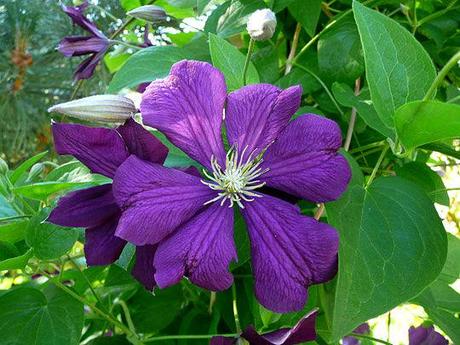
Identify the location of plant. (388, 254), (310, 165), (102, 45), (22, 14), (32, 187), (55, 313).